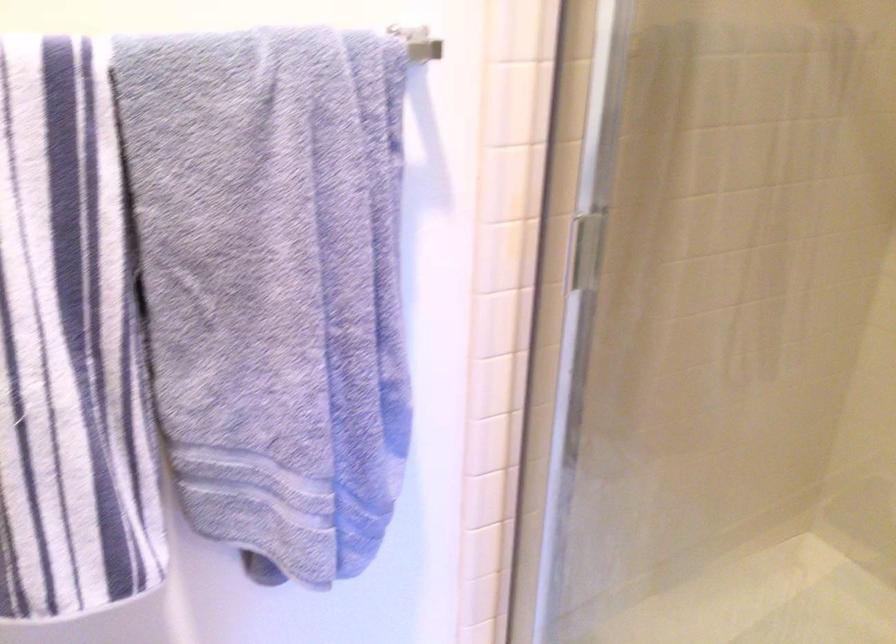
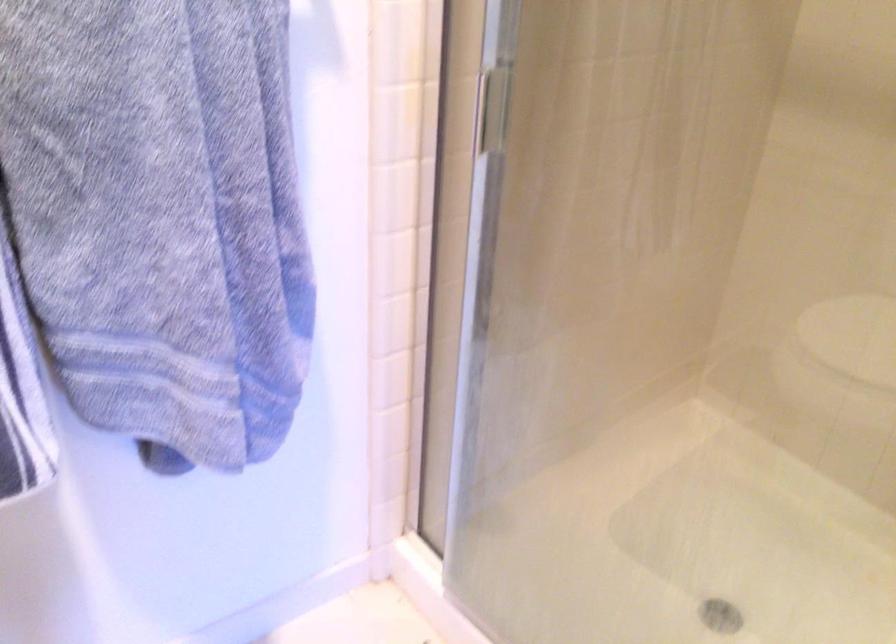
In a continuous first-person perspective shot, in which direction is the camera moving?

The cameraman walked toward left, forward.